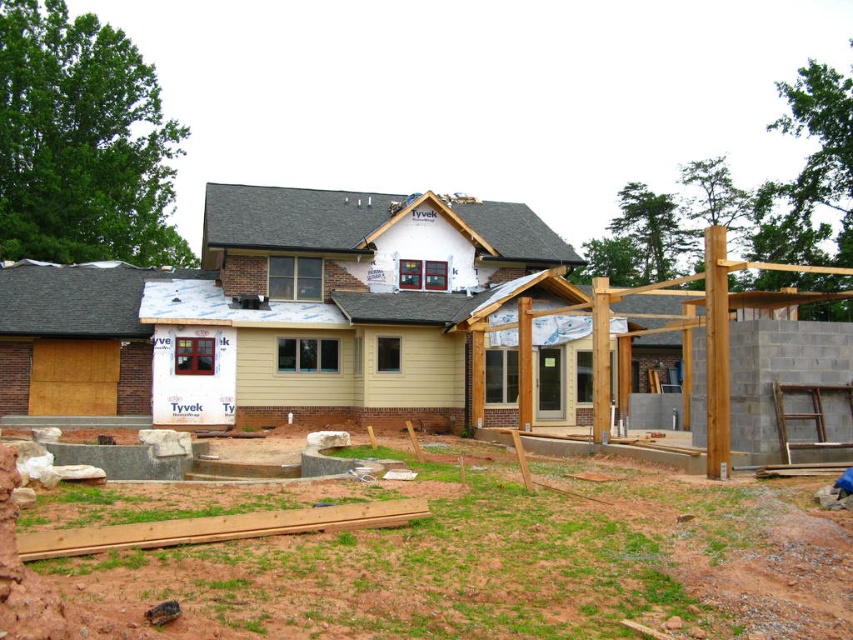
From the picture: Please provide the 2D coordinates of the beige siding at center in the image. The coordinates should be in the format of a tuple with two decimal numbers separated by a comma.

The 2D coordinates of the beige siding at center are at point (283,314).

You are a delivery person who needs to place a package that requires a flat surface 5 meters away from the green grass at lower center. Can you place the package on the beige siding at center?

The beige siding at center is 4.21 meters away from the green grass at lower center, so placing the package there would be within the required distance. However, the beige siding at center is part of an unfinished house structure and may not provide a stable or flat surface for the package.

You are a contractor inspecting the construction site. You notice the beige siding at center and the green grass at lower center. Which of these two areas requires more attention based on their size?

The beige siding at center is bigger than the green grass at lower center, so the beige siding at center likely requires more attention due to its larger area.